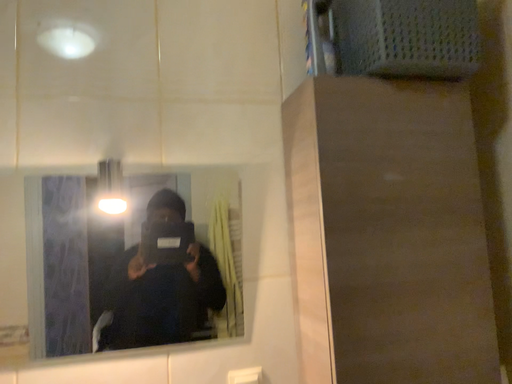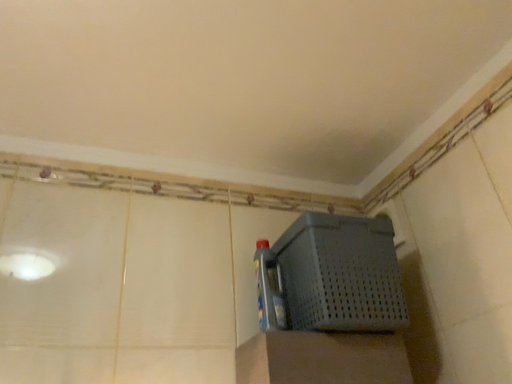
Question: Which way did the camera rotate in the video?

Choices:
 (A) rotated downward
 (B) rotated upward

Answer: (B)